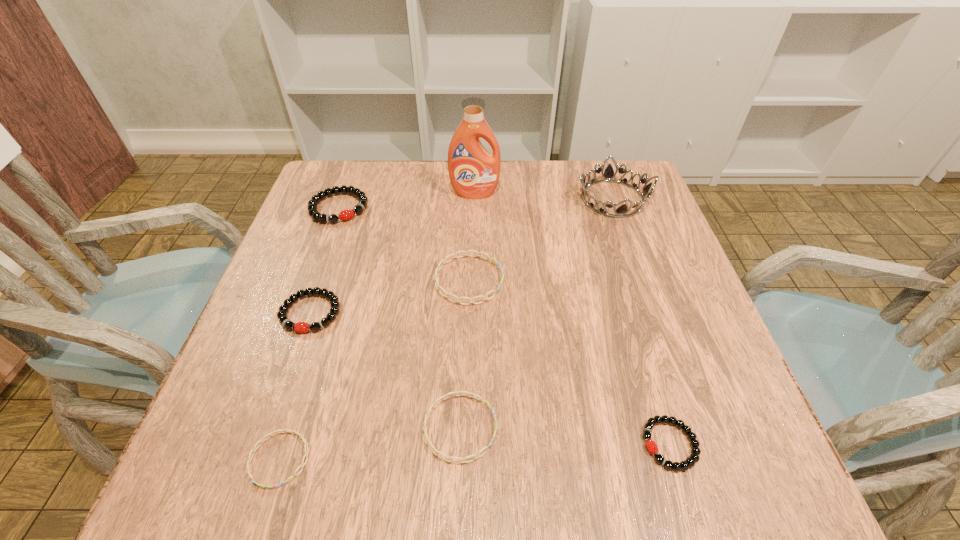
The image size is (960, 540). Find the location of `free space at the near edge`. free space at the near edge is located at coordinates (369, 464).

The image size is (960, 540). Find the location of `blank space at the left edge`. blank space at the left edge is located at coordinates (349, 271).

You are a GUI agent. You are given a task and a screenshot of the screen. Output one action in this format:
    pyautogui.click(x=<x>, y=<y>)
    Task: Click on the vacant space at the right edge of the desktop
    
    Given the screenshot: What is the action you would take?
    pyautogui.click(x=646, y=219)

This screenshot has height=540, width=960. In the image, there is a desktop. Find the location of `free space at the far right corner`. free space at the far right corner is located at coordinates (579, 160).

Where is `vacant region at the near right corner of the desktop`? This screenshot has height=540, width=960. vacant region at the near right corner of the desktop is located at coordinates click(x=727, y=474).

Locate an element on the screen. empty location between the second smallest blue bracelet and the second farthest black bracelet is located at coordinates (385, 370).

At what (x,y) coordinates should I click in order to perform the action: click on vacant area that lies between the tallest object and the rightmost bracelet. Please return your answer as a coordinate pair (x, y). The image size is (960, 540). Looking at the image, I should click on (572, 319).

At what (x,y) coordinates should I click in order to perform the action: click on vacant area that lies between the second smallest blue bracelet and the second nearest black bracelet. Please return your answer as a coordinate pair (x, y). Image resolution: width=960 pixels, height=540 pixels. Looking at the image, I should click on (385, 370).

Find the location of a particular element. This screenshot has width=960, height=540. empty space that is in between the rightmost black bracelet and the second smallest blue bracelet is located at coordinates (565, 436).

Identify the location of free space between the biggest black bracelet and the leftmost blue bracelet. (309, 333).